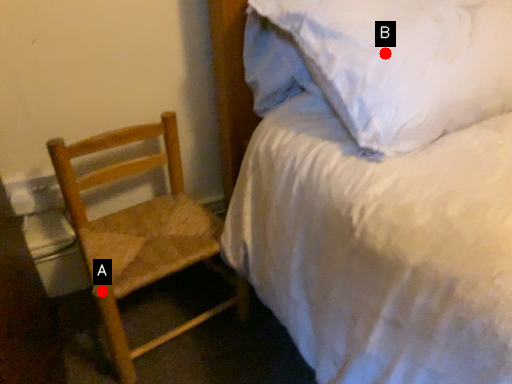
Question: Two points are circled on the image, labeled by A and B beside each circle. Which point is farther to the camera?

Choices:
 (A) A is further
 (B) B is further

Answer: (A)